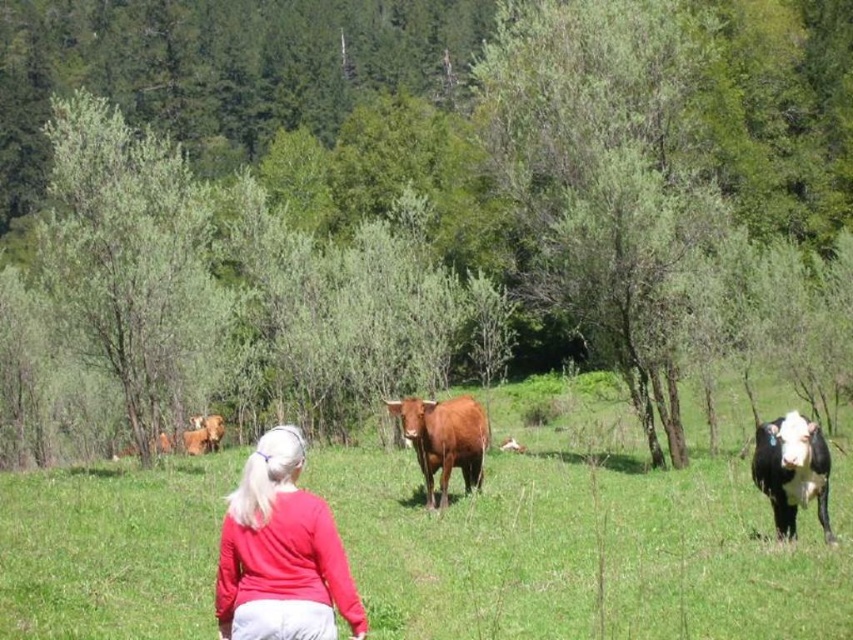
Question: Is green leafy tree at center to the right of brown glossy cow at center from the viewer's perspective?

Choices:
 (A) yes
 (B) no

Answer: (B)

Question: Which point appears farthest from the camera in this image?

Choices:
 (A) (148, 456)
 (B) (785, 504)

Answer: (A)

Question: Does green leafy tree at left appear on the left side of brown fur cow at center?

Choices:
 (A) yes
 (B) no

Answer: (A)

Question: Which object is positioned farthest from the green leafy tree at left?

Choices:
 (A) matte red sweater at center
 (B) brown glossy cow at center
 (C) green leafy tree at center

Answer: (B)

Question: Can you confirm if green leafy tree at center is thinner than brown fur cow at center?

Choices:
 (A) yes
 (B) no

Answer: (B)

Question: Which object appears farthest from the camera in this image?

Choices:
 (A) matte red sweater at center
 (B) green leafy tree at left
 (C) black and white cow at right
 (D) brown fur cow at center

Answer: (D)